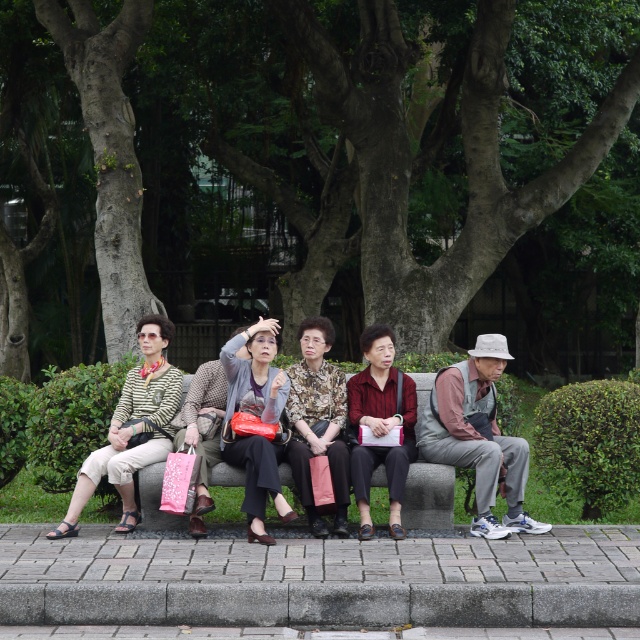
Question: Is gray concrete curb at lower center further to the viewer compared to striped fabric sweater at left?

Choices:
 (A) yes
 (B) no

Answer: (B)

Question: Which point is closer to the camera?

Choices:
 (A) gray concrete curb at lower center
 (B) green textured tree at center

Answer: (A)

Question: Estimate the real-world distances between objects in this image. Which object is farther from the gray stone bench at center?

Choices:
 (A) smooth gray bark at left
 (B) green textured tree at center
 (C) gray concrete curb at lower center
 (D) striped fabric sweater at left

Answer: (B)

Question: Does maroon fabric jacket at center have a lesser width compared to gray stone bench at center?

Choices:
 (A) yes
 (B) no

Answer: (B)

Question: Is patterned fabric blouse at center above matte gray sweater at center?

Choices:
 (A) no
 (B) yes

Answer: (B)

Question: Which of the following is the farthest from the observer?

Choices:
 (A) gray concrete curb at lower center
 (B) gray stone bench at center

Answer: (B)